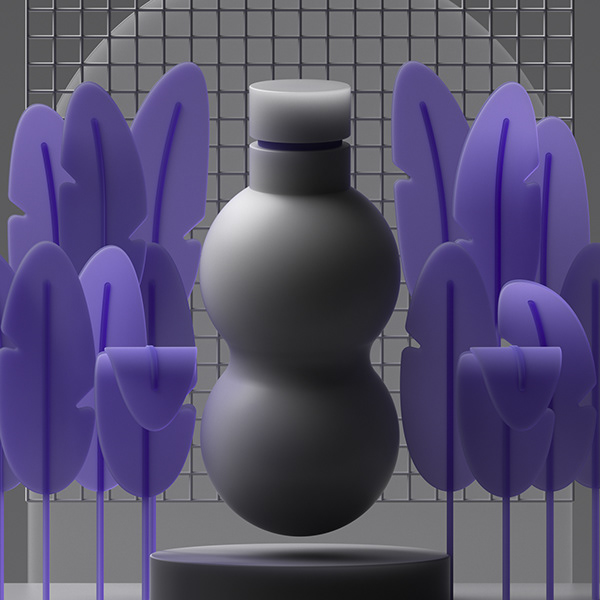
Locate an element on the screen. gray rack is located at coordinates (416, 495).